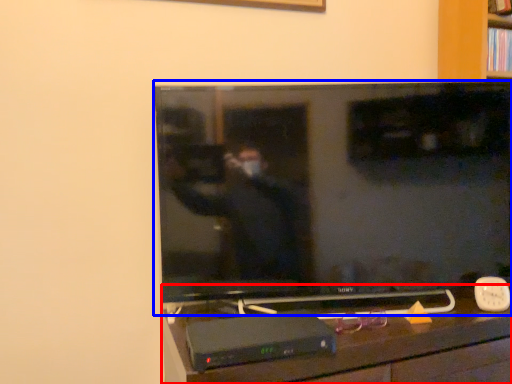
Question: Which point is further to the camera, furniture (highlighted by a red box) or television (highlighted by a blue box)?

Choices:
 (A) furniture
 (B) television

Answer: (B)